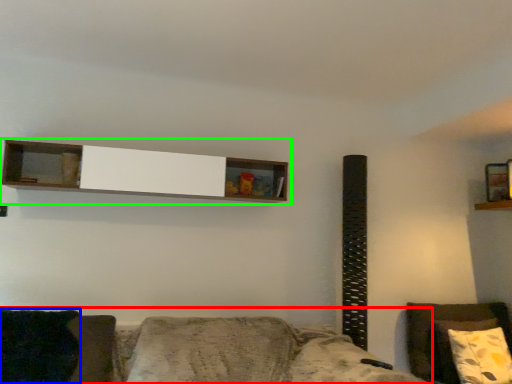
Question: Based on their relative distances, which object is farther from studio couch (highlighted by a red box)? Choose from pillow (highlighted by a blue box) and shelf (highlighted by a green box).

Choices:
 (A) pillow
 (B) shelf

Answer: (B)